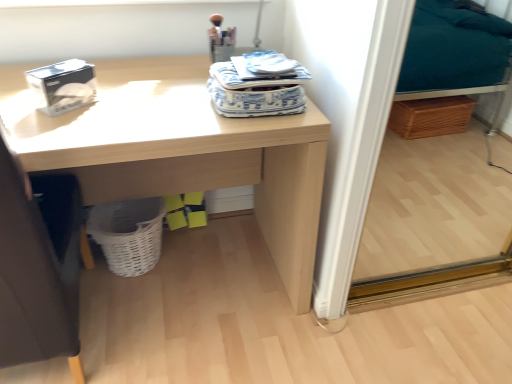
Locate an element on the screen. The image size is (512, 384). vacant space in between light wood desk at center and dark gray fabric swivel chair at left is located at coordinates (179, 352).